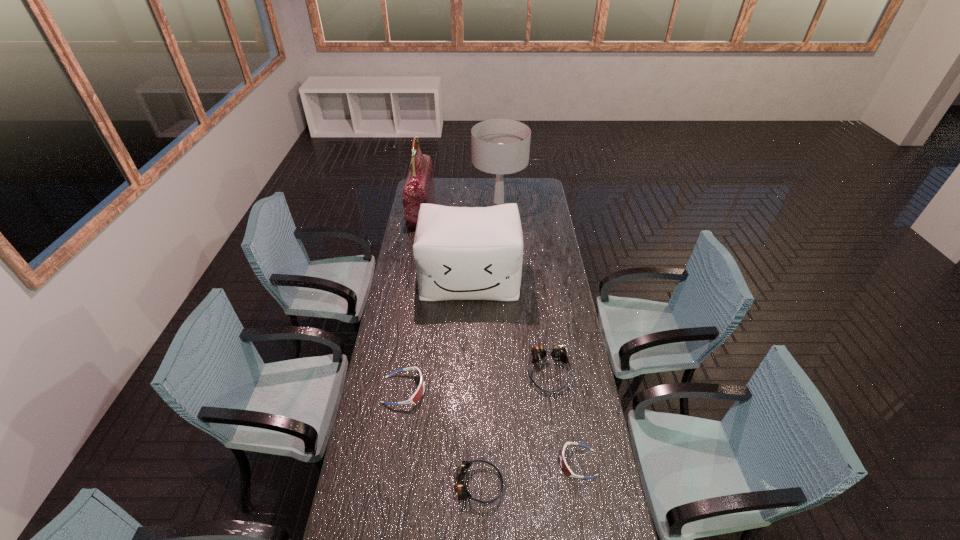
You are a GUI agent. You are given a task and a screenshot of the screen. Output one action in this format:
    pyautogui.click(x=<x>, y=<y>)
    Task: Click on the bronze goggles that is the nearest to the white cushion
    
    Given the screenshot: What is the action you would take?
    pyautogui.click(x=558, y=352)

The image size is (960, 540). In order to click on free location that satisfies the following two spatial constraints: 1. through the lenses of the bigger bronze goggles; 2. on the front-facing side of the bigger red goggles in this screenshot , I will do click(x=551, y=390).

Where is `vacant region that satisfies the following two spatial constraints: 1. on the front-facing side of the lampshade; 2. through the lenses of the smaller bronze goggles`? The width and height of the screenshot is (960, 540). vacant region that satisfies the following two spatial constraints: 1. on the front-facing side of the lampshade; 2. through the lenses of the smaller bronze goggles is located at coordinates (516, 484).

Locate an element on the screen. The width and height of the screenshot is (960, 540). free space that satisfies the following two spatial constraints: 1. on the front-facing side of the lampshade; 2. on the front-facing side of the farther red goggles is located at coordinates (510, 390).

Identify the location of free space that satisfies the following two spatial constraints: 1. through the lenses of the farther bronze goggles; 2. on the front-facing side of the bigger red goggles. This screenshot has width=960, height=540. (551, 390).

Identify the location of free spot that satisfies the following two spatial constraints: 1. on the front-facing side of the lampshade; 2. on the front-facing side of the bigger red goggles. tap(510, 390).